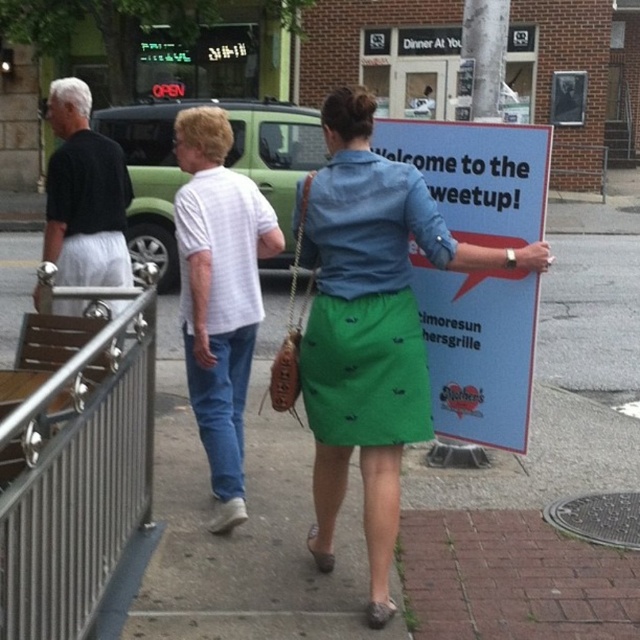
Question: Does green fabric skirt at center have a greater width compared to white woven shirt at center?

Choices:
 (A) no
 (B) yes

Answer: (B)

Question: Which of these objects is positioned closest to the white woven shirt at center?

Choices:
 (A) green fabric skirt at center
 (B) blue paper sign at center
 (C) green printed skirt at center
 (D) denim skirt at center

Answer: (D)

Question: Which point is farther to the camera?

Choices:
 (A) (240, 369)
 (B) (122, 246)
 (C) (486, 330)

Answer: (B)

Question: Does satin silver railing at lower left appear over green printed skirt at center?

Choices:
 (A) yes
 (B) no

Answer: (B)

Question: Where is white woven shirt at center located in relation to black cotton t-shirt at left in the image?

Choices:
 (A) right
 (B) left

Answer: (A)

Question: Based on their relative distances, which object is farther from the blue paper sign at center?

Choices:
 (A) satin silver railing at lower left
 (B) black cotton t-shirt at left
 (C) green fabric skirt at center
 (D) denim skirt at center

Answer: (B)